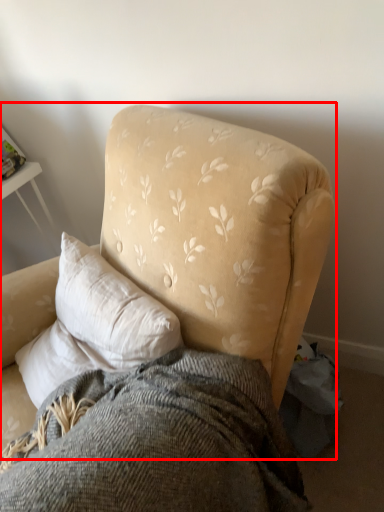
Question: In this image, where is chair (annotated by the red box) located relative to bedding?

Choices:
 (A) left
 (B) right

Answer: (A)